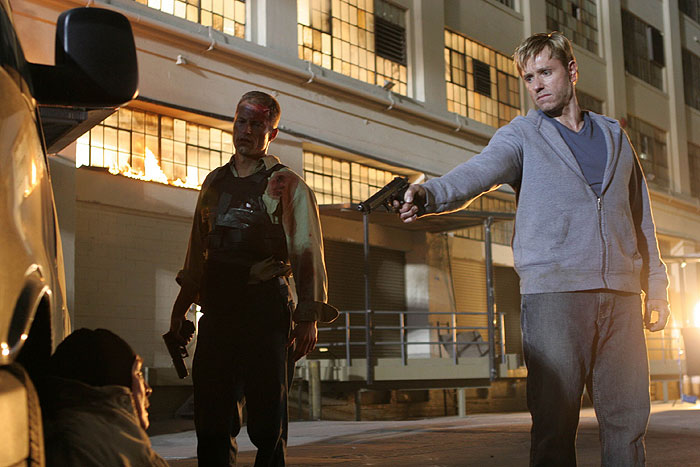
Locate an element on the screen. cover is located at coordinates (472, 213).